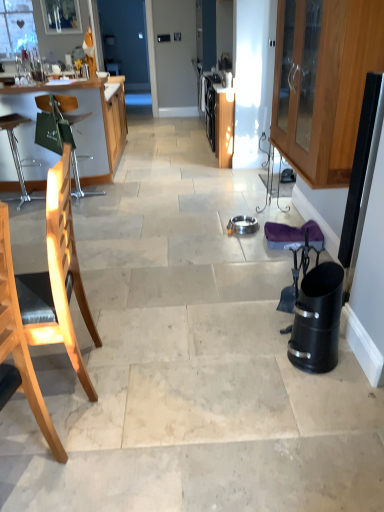
The width and height of the screenshot is (384, 512). I want to click on vacant area located to the right-hand side of black plastic trash can at right, so click(347, 365).